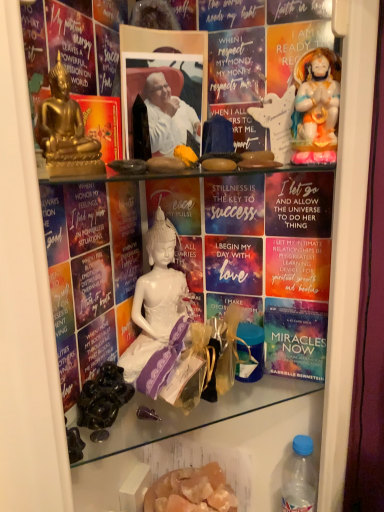
Question: Is point (147, 342) closer or farther from the camera than point (173, 473)?

Choices:
 (A) closer
 (B) farther

Answer: (A)

Question: In terms of height, does purple satin dress at center look taller or shorter compared to translucent orange crystals at lower center, which ranks as the first food in bottom-to-top order?

Choices:
 (A) short
 (B) tall

Answer: (A)

Question: Considering the real-world distances, which object is farthest from the gold polished buddha statue at upper left, which is the first person from front to back?

Choices:
 (A) blue plastic bottle at lower right
 (B) translucent orange crystals at lower center, marked as the first food in a back-to-front arrangement
 (C) white porcelain statue at upper right
 (D) white glossy statue at upper right, acting as the second person starting from the left
 (E) black glossy grapes at lower left, acting as the second food starting from the right

Answer: (A)

Question: Estimate the real-world distances between objects in this image. Which object is closer to the purple satin dress at center?

Choices:
 (A) white glossy statue at upper right, acting as the second person starting from the left
 (B) blue plastic bottle at lower right
 (C) black glossy grapes at lower left, acting as the 2th food starting from the bottom
 (D) white porcelain statue at upper right
 (E) gold polished buddha statue at upper left, marked as the second person in a right-to-left arrangement

Answer: (C)